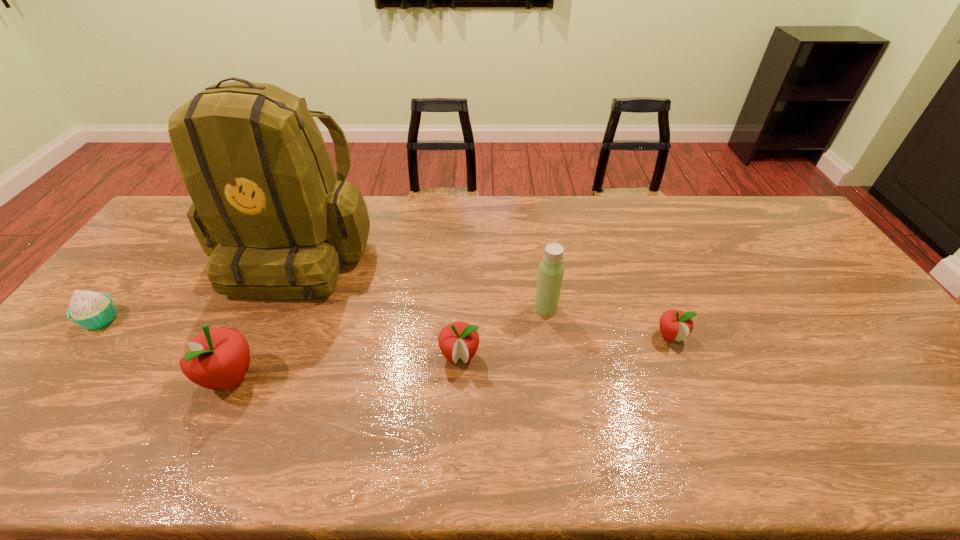
Image resolution: width=960 pixels, height=540 pixels. I want to click on vacant space at the near edge of the desktop, so click(822, 410).

Where is `vacant point at the left edge`? vacant point at the left edge is located at coordinates (82, 334).

In the image, there is a desktop. At what (x,y) coordinates should I click in order to perform the action: click on vacant space at the right edge. Please return your answer as a coordinate pair (x, y). Looking at the image, I should click on (776, 249).

Find the location of a particular element. This screenshot has width=960, height=540. vacant space at the near right corner is located at coordinates (905, 419).

The height and width of the screenshot is (540, 960). Identify the location of free area in between the leftmost object and the thermos bottle. (324, 314).

Identify the location of free space between the leftmost object and the tallest object. (199, 285).

The width and height of the screenshot is (960, 540). I want to click on free space between the fifth object from left to right and the tallest object, so click(x=421, y=279).

What are the coordinates of `empty location between the rightmost object and the backpack` in the screenshot? It's located at (484, 293).

The width and height of the screenshot is (960, 540). Identify the location of vacant area that lies between the cupcake and the backpack. (199, 285).

Where is `empty space between the leftmost object and the rightmost apple`? empty space between the leftmost object and the rightmost apple is located at coordinates (385, 327).